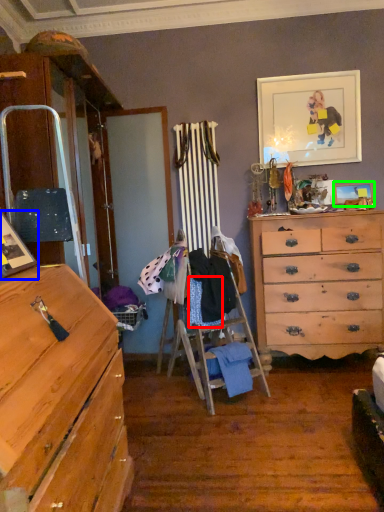
Question: Which is nearer to the clothing (highlighted by a red box)? picture frame (highlighted by a blue box) or picture frame (highlighted by a green box).

Choices:
 (A) picture frame
 (B) picture frame

Answer: (A)